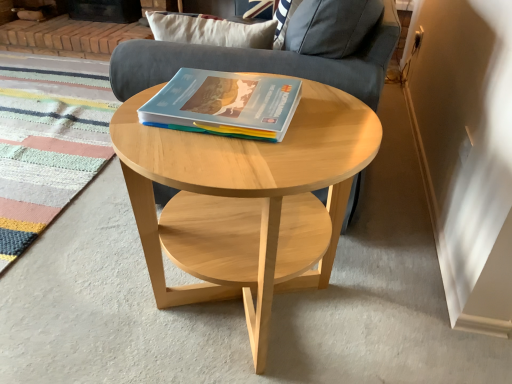
I want to click on free spot in front of matte plastic book at center, so click(x=221, y=162).